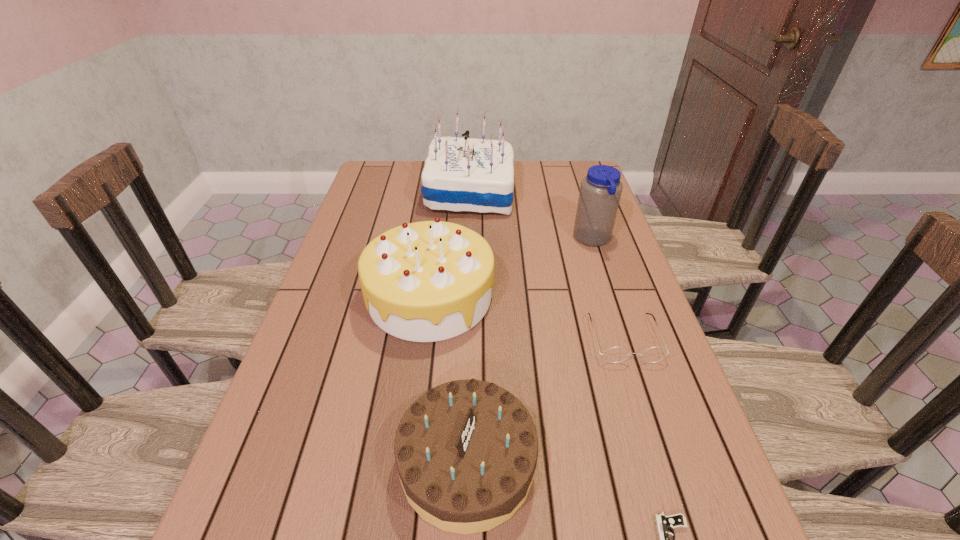
Locate which birthday cake ranks second in proximity to the fourth tallest object. Please provide its 2D coordinates. Your answer should be formatted as a tuple, i.e. [(x, y)], where the tuple contains the x and y coordinates of a point satisfying the conditions above.

[(460, 174)]

You are a GUI agent. You are given a task and a screenshot of the screen. Output one action in this format:
    pyautogui.click(x=<x>, y=<y>)
    Task: Click on the birthday cake that stands as the closest to the tallest birthday cake
    
    Given the screenshot: What is the action you would take?
    pyautogui.click(x=427, y=281)

This screenshot has width=960, height=540. Identify the location of free space that satisfies the following two spatial constraints: 1. on the back side of the farthest birthday cake; 2. on the right side of the second farthest birthday cake. (443, 193).

I want to click on vacant space that satisfies the following two spatial constraints: 1. on the front-facing side of the spectacles; 2. on the front-facing side of the nearest birthday cake, so click(x=664, y=463).

Where is `free spot that satisfies the following two spatial constraints: 1. with a carrying loop on the side of the water bottle; 2. on the front-facing side of the fifth tallest object`? This screenshot has height=540, width=960. free spot that satisfies the following two spatial constraints: 1. with a carrying loop on the side of the water bottle; 2. on the front-facing side of the fifth tallest object is located at coordinates (624, 339).